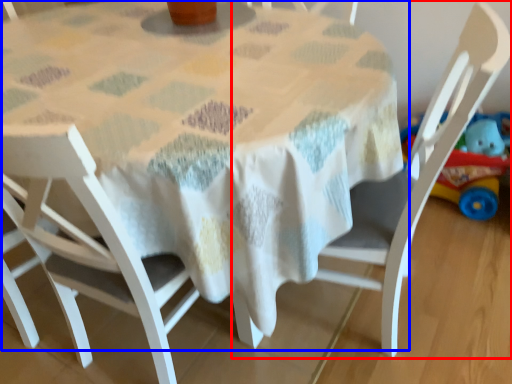
Question: Which of the following is the closest to the observer, chair (highlighted by a red box) or table (highlighted by a blue box)?

Choices:
 (A) chair
 (B) table

Answer: (B)